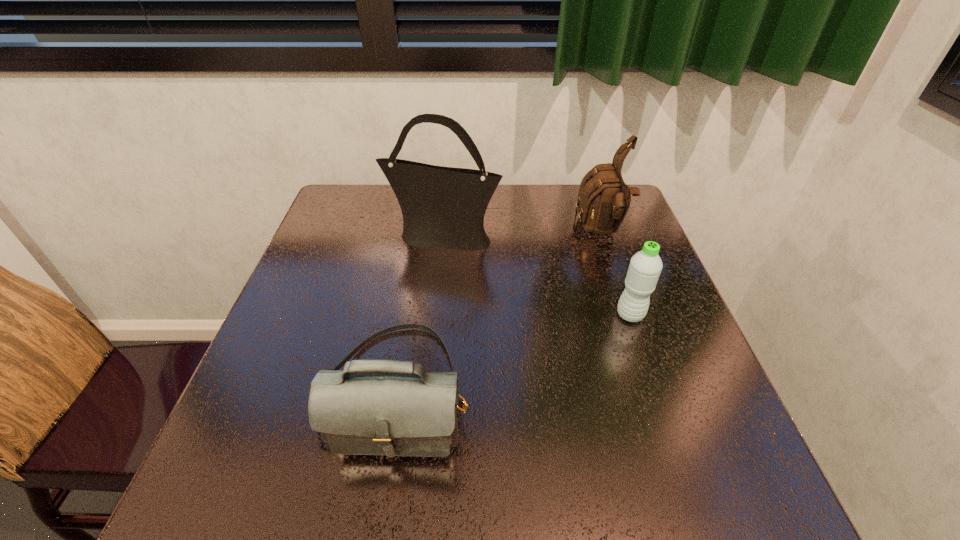
Locate an element on the screen. This screenshot has height=540, width=960. free point between the rightmost shoulder bag and the tallest shoulder bag is located at coordinates (522, 234).

This screenshot has width=960, height=540. Find the location of `unoccupied position between the second shortest shoulder bag and the water bottle`. unoccupied position between the second shortest shoulder bag and the water bottle is located at coordinates (615, 273).

You are a GUI agent. You are given a task and a screenshot of the screen. Output one action in this format:
    pyautogui.click(x=<x>, y=<y>)
    Task: Click on the free space that is in between the nearest object and the second tallest object
    Image resolution: width=960 pixels, height=540 pixels.
    Given the screenshot: What is the action you would take?
    pyautogui.click(x=500, y=311)

Identify which object is located as the second nearest to the rightmost shoulder bag. Please provide its 2D coordinates. Your answer should be formatted as a tuple, i.e. [(x, y)], where the tuple contains the x and y coordinates of a point satisfying the conditions above.

[(442, 207)]

The image size is (960, 540). I want to click on object that is the closest to the water bottle, so click(x=603, y=200).

Select which shoulder bag is the closest to the nearest shoulder bag. Please provide its 2D coordinates. Your answer should be formatted as a tuple, i.e. [(x, y)], where the tuple contains the x and y coordinates of a point satisfying the conditions above.

[(442, 207)]

Where is `the closest shoulder bag to the nearest shoulder bag`? The width and height of the screenshot is (960, 540). the closest shoulder bag to the nearest shoulder bag is located at coordinates (442, 207).

This screenshot has width=960, height=540. I want to click on free space that satisfies the following two spatial constraints: 1. on the front-facing side of the second nearest object; 2. on the right side of the second tallest shoulder bag, so click(630, 315).

The image size is (960, 540). I want to click on vacant area in the image that satisfies the following two spatial constraints: 1. on the front-facing side of the rightmost shoulder bag; 2. on the front side of the tallest object, so tap(603, 237).

This screenshot has width=960, height=540. I want to click on free space that satisfies the following two spatial constraints: 1. on the front-facing side of the rightmost shoulder bag; 2. on the front side of the nearest shoulder bag, so click(x=656, y=390).